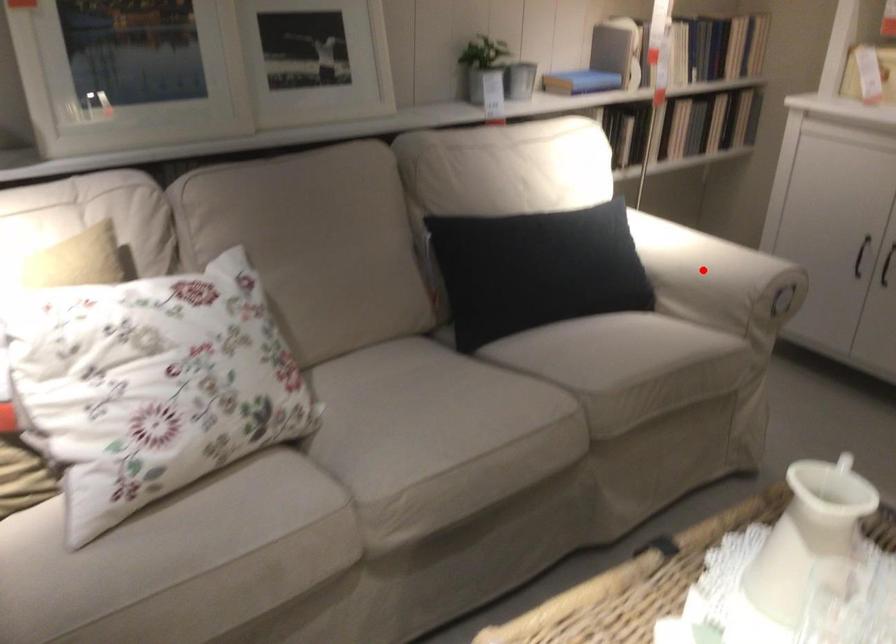
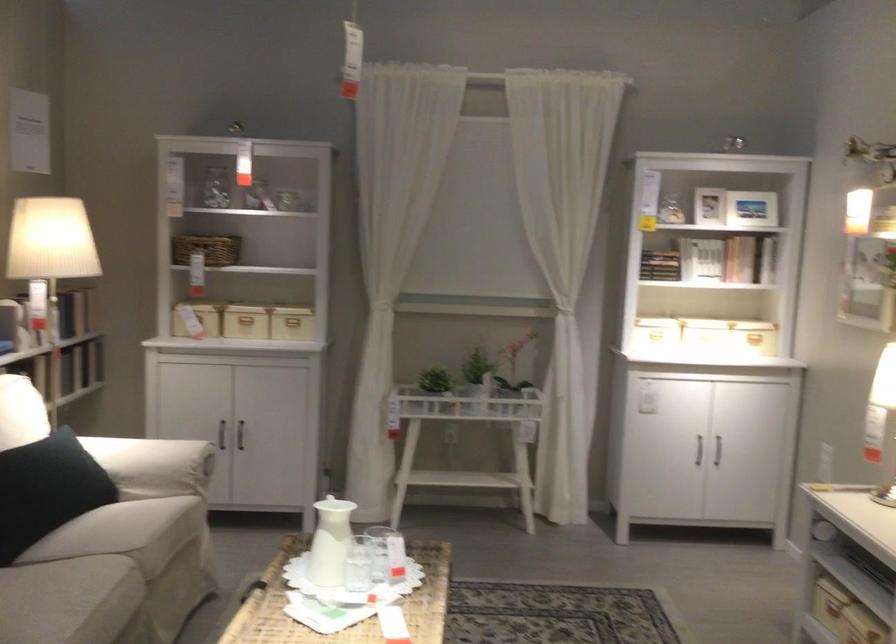
Where in the second image is the point corresponding to the highlighted location from the first image?

(152, 465)